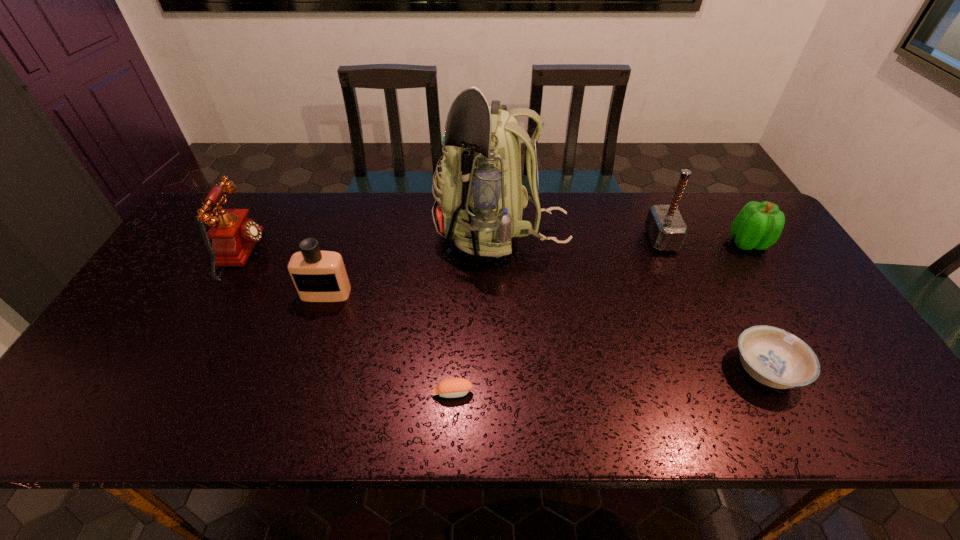
Locate an element on the screen. The height and width of the screenshot is (540, 960). vacant region located on the front-facing side of the tallest object is located at coordinates (338, 236).

Where is `vacant space located on the front-facing side of the tallest object`? Image resolution: width=960 pixels, height=540 pixels. vacant space located on the front-facing side of the tallest object is located at coordinates (361, 236).

Where is `free location located on the front of the sixth shortest object`? This screenshot has width=960, height=540. free location located on the front of the sixth shortest object is located at coordinates 689,306.

Where is `free region located on the dial of the leftmost object`? This screenshot has height=540, width=960. free region located on the dial of the leftmost object is located at coordinates (395, 254).

Where is `free space located on the front label of the sixth object from right to left`? free space located on the front label of the sixth object from right to left is located at coordinates (284, 423).

Find the location of a particular element. This screenshot has width=960, height=540. vacant area situated on the front of the third shortest object is located at coordinates (819, 356).

Where is `free space located 0.100m on the right of the bowl`? Image resolution: width=960 pixels, height=540 pixels. free space located 0.100m on the right of the bowl is located at coordinates (843, 370).

This screenshot has width=960, height=540. What are the coordinates of `vacant space located on the left of the shortest object` in the screenshot? It's located at (264, 393).

This screenshot has width=960, height=540. Identify the location of backpack situated at the far edge. (479, 201).

Where is `hammer that is at the far edge`? hammer that is at the far edge is located at coordinates (665, 226).